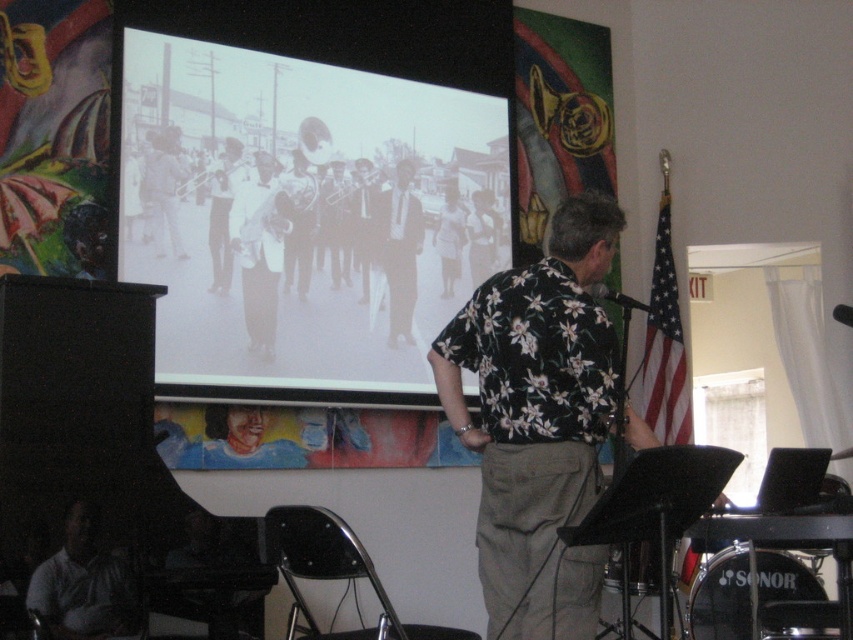
You are an event planner organizing a presentation. You need to ensure the audience can see both the black matte projection screen at upper center and the khaki pants at center clearly. Which object is positioned higher in the image?

The black matte projection screen at upper center is positioned above the khaki pants at center, so it is higher in the image.

You are standing in the room where the presentation is happening. There is a point at coordinates (300, 212). Which object is this point located on?

The point at coordinates (300, 212) is located on the black matte projection screen at upper center.

You are an event organizer setting up the stage for a jazz performance. You need to ensure that the audience can clearly see both the black matte projection screen at upper center and the matte black trombone at center. Based on their positions, which object is closer to the audience?

The black matte projection screen at upper center is closer to the audience because it is positioned in front of the matte black trombone at center.